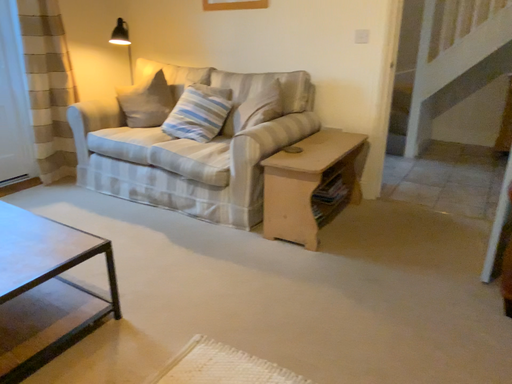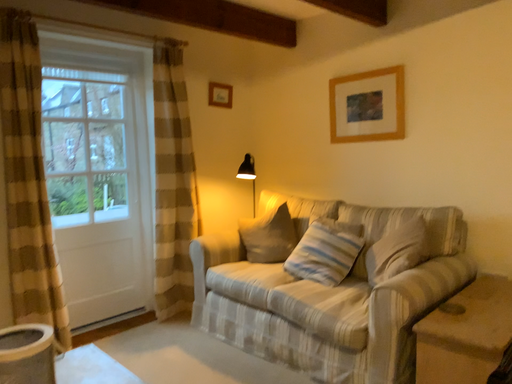
Question: How did the camera likely rotate when shooting the video?

Choices:
 (A) rotated left
 (B) rotated right

Answer: (A)